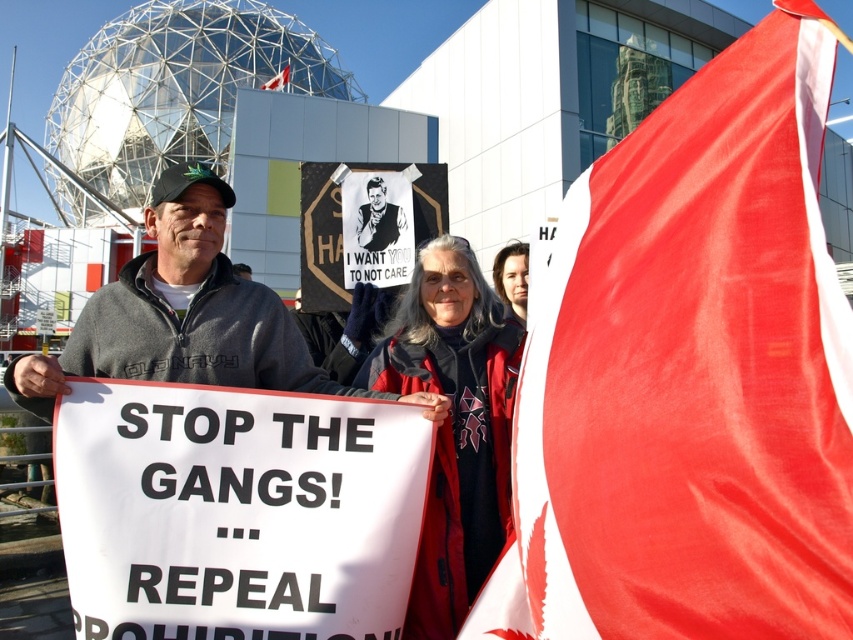
Question: Estimate the real-world distances between objects in this image. Which object is closer to the matte black sign at center?

Choices:
 (A) red fabric flag at upper right
 (B) red fabric flag at center
 (C) red wool scarf at center

Answer: (C)

Question: Can you confirm if red fabric flag at center is smaller than gray fleece jacket at center?

Choices:
 (A) no
 (B) yes

Answer: (A)

Question: Which point is closer to the camera?

Choices:
 (A) (396, 216)
 (B) (416, 604)
 (C) (653, 168)

Answer: (C)

Question: Can you confirm if gray fleece jacket at center is thinner than red fabric flag at upper right?

Choices:
 (A) no
 (B) yes

Answer: (A)

Question: Which point is farther to the camera?

Choices:
 (A) (183, 188)
 (B) (387, 225)
 (C) (515, 305)
 (D) (459, 413)

Answer: (C)

Question: Does gray fleece jacket at center come behind red wool scarf at center?

Choices:
 (A) no
 (B) yes

Answer: (A)